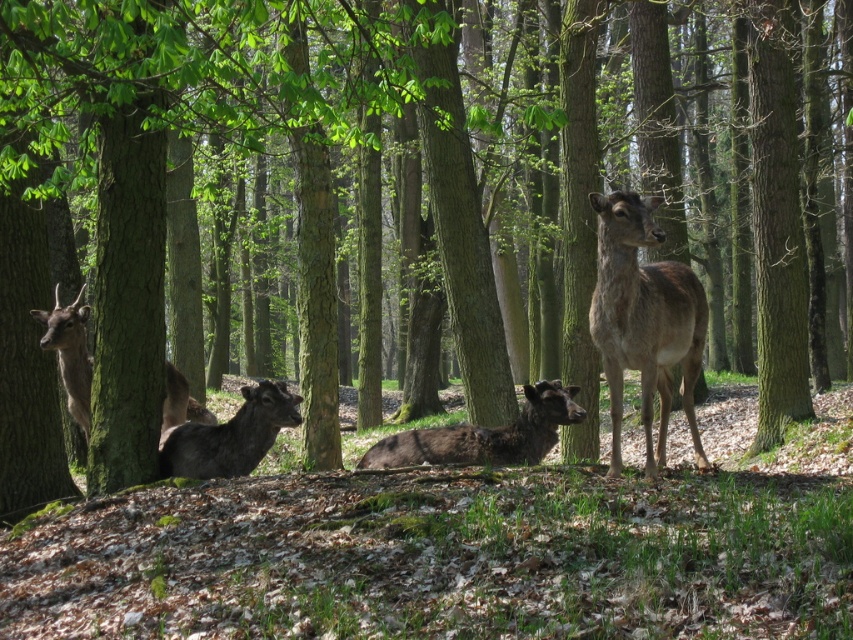
Question: Can you confirm if brown matte/deer at center is positioned above dark brown fur at center?

Choices:
 (A) no
 (B) yes

Answer: (B)

Question: Which object is the farthest from the brown matte/deer at center?

Choices:
 (A) dark brown fur at center
 (B) brown fur deer at left

Answer: (B)

Question: Can you confirm if dark brown fur at center is thinner than brown fur deer at left?

Choices:
 (A) yes
 (B) no

Answer: (B)

Question: Does brown fur at center appear under brown fur deer at left?

Choices:
 (A) no
 (B) yes

Answer: (B)

Question: Which point appears farthest from the camera in this image?

Choices:
 (A) (77, 356)
 (B) (248, 448)
 (C) (373, 456)
 (D) (611, 448)

Answer: (A)

Question: Which object is farther from the camera taking this photo?

Choices:
 (A) brown fur deer at left
 (B) brown matte/deer at center
 (C) dark brown fur at center
 (D) brown fur at center

Answer: (A)